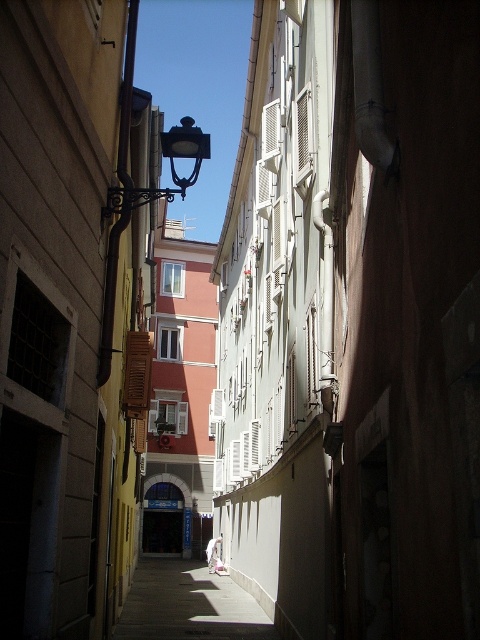
You are a delivery person with a cart that requires a large flat space. You see the smooth concrete sidewalk at center and the polished brass streetlamp at upper center. Which area would be suitable for parking your cart?

The smooth concrete sidewalk at center is bigger than the polished brass streetlamp at upper center, so it is suitable for parking the cart.

You are a delivery person carrying a box and need to walk from the entrance of the alley to the end. You see the smooth concrete sidewalk at center and the polished brass streetlamp at upper center. Which object is closer to you as you enter the alley?

The smooth concrete sidewalk at center is closer to you than the polished brass streetlamp at upper center as you enter the alley.